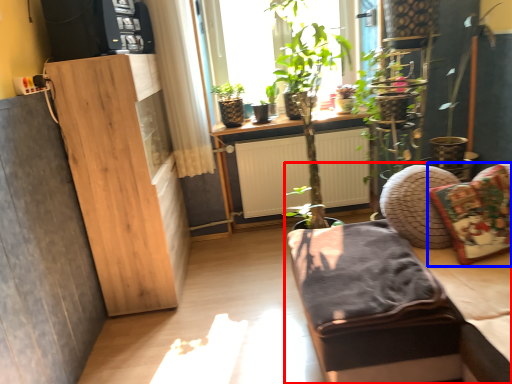
Question: Which point is closer to the camera, studio couch (highlighted by a red box) or pillow (highlighted by a blue box)?

Choices:
 (A) studio couch
 (B) pillow

Answer: (A)